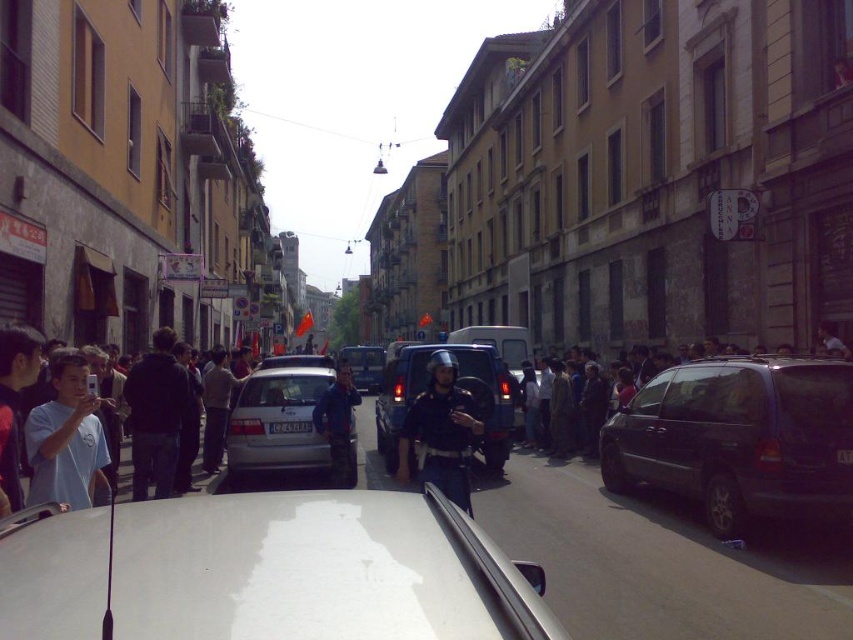
Is dark blue uniform at center below light blue shirt at left?

Yes, dark blue uniform at center is below light blue shirt at left.

Measure the distance between dark blue uniform at center and camera.

dark blue uniform at center is 6.26 meters from camera.

I want to click on dark blue uniform at center, so click(440, 432).

Which is above, dark gray matte van at center-right or light blue cotton shirt at center?

light blue cotton shirt at center

Is point (735, 365) farther from viewer compared to point (44, 435)?

That is True.

Find the location of `dark gray matte van at center-right`. dark gray matte van at center-right is located at coordinates (740, 440).

Does light blue shirt at left have a greater width compared to light brown leather jacket at center?

Incorrect, light blue shirt at left's width does not surpass light brown leather jacket at center's.

Is point (3, 449) closer to viewer compared to point (222, 408)?

That is True.

Identify the location of light blue shirt at left. This screenshot has height=640, width=853. (15, 400).